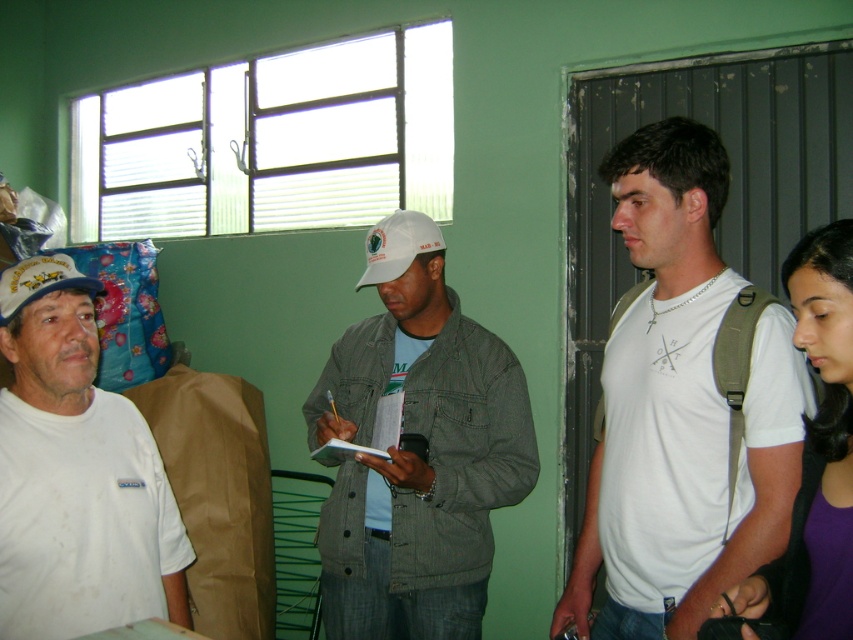
Question: Does white cotton t-shirt at right appear under white matte cap at center?

Choices:
 (A) yes
 (B) no

Answer: (B)

Question: Can you confirm if white matte cap at center is positioned below white matte t-shirt at left?

Choices:
 (A) yes
 (B) no

Answer: (B)

Question: Does white cotton t-shirt at right appear over white fabric baseball cap at left?

Choices:
 (A) no
 (B) yes

Answer: (A)

Question: Which object appears farthest from the camera in this image?

Choices:
 (A) white matte cap at center
 (B) white matte t-shirt at left
 (C) white cotton t-shirt at right

Answer: (A)

Question: Among these objects, which one is farthest from the camera?

Choices:
 (A) white matte cap at center
 (B) white matte baseball cap at center

Answer: (B)

Question: Which object appears closest to the camera in this image?

Choices:
 (A) white fabric baseball cap at left
 (B) white matte baseball cap at center

Answer: (A)